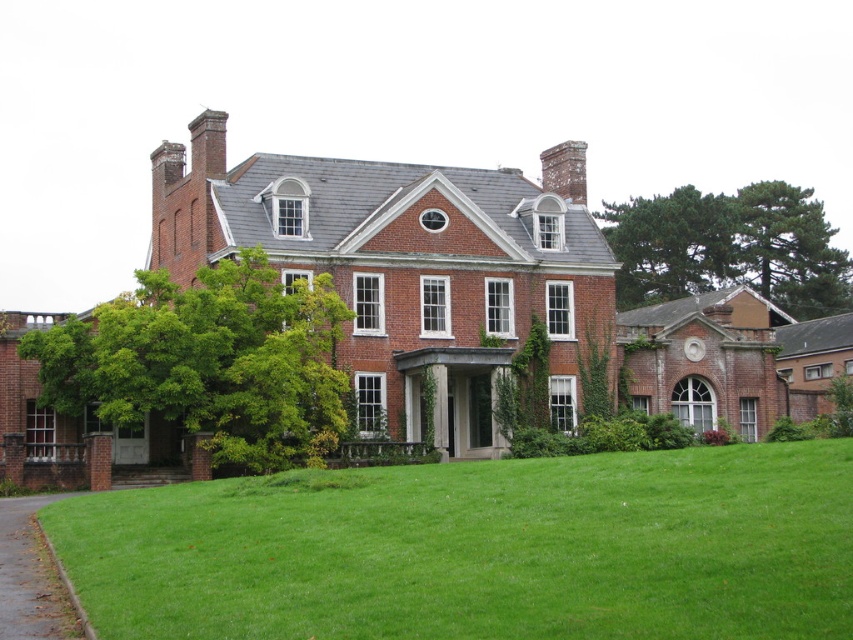
You are standing in front of the house and want to take a photo that includes both the green grass at lower left and the green leafy tree at upper right. Which of these two objects will appear smaller in the photo?

The green grass at lower left will appear smaller in the photo because its width is less than that of the green leafy tree at upper right.

You are standing at the center of the house and want to find the green grass at lower left. Which direction should you face to see it?

The green grass at lower left is located at point (480, 548), so you should face towards the lower left direction to see it.